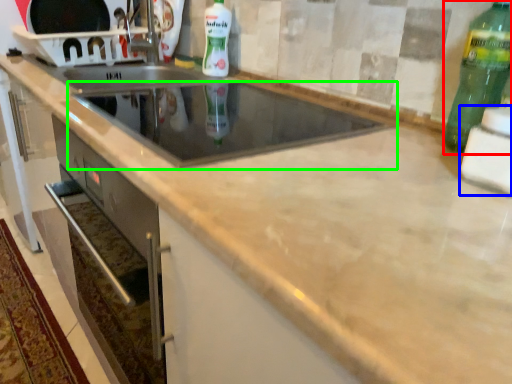
Question: Based on their relative distances, which object is nearer to bottle (highlighted by a red box)? Choose from appliance (highlighted by a blue box) and appliance (highlighted by a green box).

Choices:
 (A) appliance
 (B) appliance

Answer: (A)